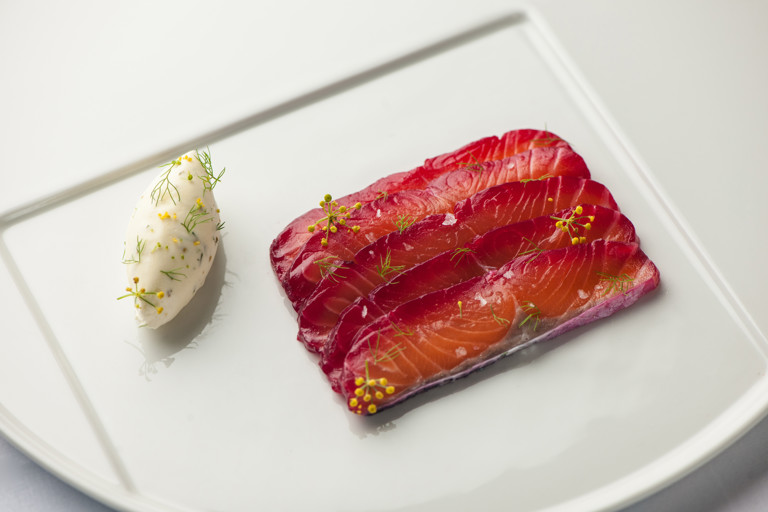
Locate an element on the screen. This screenshot has height=512, width=768. square inside of tray is located at coordinates pos(419,102).